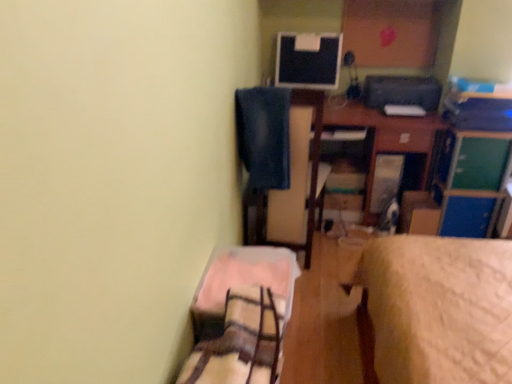
What do you see at coordinates (308, 60) in the screenshot?
I see `matte black monitor at upper center` at bounding box center [308, 60].

Locate an element on the screen. The height and width of the screenshot is (384, 512). wooden desk at center is located at coordinates point(386,139).

Describe the element at coordinates (471, 181) in the screenshot. The width and height of the screenshot is (512, 384). I see `green matte file cabinet at upper right` at that location.

At what (x,y) coordinates should I click in order to perform the action: click on matte black monitor at upper center. Please return your answer as a coordinate pair (x, y). The image size is (512, 384). Looking at the image, I should click on (308, 60).

Considering the sizes of objects plaid fabric bed at lower left and matte black monitor at upper center in the image provided, who is bigger, plaid fabric bed at lower left or matte black monitor at upper center?

matte black monitor at upper center is bigger.

Can you confirm if plaid fabric bed at lower left is shorter than matte black monitor at upper center?

Correct, plaid fabric bed at lower left is not as tall as matte black monitor at upper center.

Could you tell me if plaid fabric bed at lower left is facing matte black monitor at upper center?

No, plaid fabric bed at lower left is not facing towards matte black monitor at upper center.

Based on the photo, considering the relative positions of plaid fabric bed at lower left and matte black monitor at upper center in the image provided, is plaid fabric bed at lower left to the left or to the right of matte black monitor at upper center?

In the image, plaid fabric bed at lower left appears on the left side of matte black monitor at upper center.

Is cardboard box at center positioned behind green matte file cabinet at upper right?

Yes.

Find the location of a particular element. cardboard box on the left of green matte file cabinet at upper right is located at coordinates (419, 214).

From a real-world perspective, is cardboard box at center positioned above or below green matte file cabinet at upper right?

cardboard box at center is below green matte file cabinet at upper right.

Is cardboard box at center thinner than green matte file cabinet at upper right?

Indeed, cardboard box at center has a lesser width compared to green matte file cabinet at upper right.

Is plaid fabric bed at lower left to the right of cardboard box at center from the viewer's perspective?

Incorrect, plaid fabric bed at lower left is not on the right side of cardboard box at center.

In the scene shown: Is plaid fabric bed at lower left looking in the opposite direction of cardboard box at center?

No.

Considering the sizes of objects plaid fabric bed at lower left and cardboard box at center in the image provided, who is wider, plaid fabric bed at lower left or cardboard box at center?

Wider between the two is plaid fabric bed at lower left.

Can you tell me how much plaid fabric bed at lower left and cardboard box at center differ in facing direction?

87.5 degrees separate the facing orientations of plaid fabric bed at lower left and cardboard box at center.

Does matte black monitor at upper center have a lesser width compared to cardboard box at center?

Correct, the width of matte black monitor at upper center is less than that of cardboard box at center.

Where is `cardboard box that appears below the matte black monitor at upper center (from a real-world perspective)`? cardboard box that appears below the matte black monitor at upper center (from a real-world perspective) is located at coordinates (419, 214).

From the picture: Between matte black monitor at upper center and cardboard box at center, which one has more height?

Standing taller between the two is matte black monitor at upper center.

Who is smaller, wooden desk at center or cardboard box at center?

Smaller between the two is cardboard box at center.

From the image's perspective, is wooden desk at center located above cardboard box at center?

Yes, from the image's perspective, wooden desk at center is above cardboard box at center.

Is wooden desk at center next to cardboard box at center?

No, wooden desk at center is not beside cardboard box at center.

Is wooden desk at center looking in the opposite direction of cardboard box at center?

wooden desk at center does not have its back to cardboard box at center.

Who is smaller, matte black monitor at upper center or plaid fabric bed at lower left?

plaid fabric bed at lower left.

Is matte black monitor at upper center in front of or behind plaid fabric bed at lower left in the image?

matte black monitor at upper center is behind plaid fabric bed at lower left.

Consider the image. How distant is matte black monitor at upper center from plaid fabric bed at lower left?

The distance of matte black monitor at upper center from plaid fabric bed at lower left is 5.50 feet.

Between cardboard box at center and matte black monitor at upper center, which one has more height?

matte black monitor at upper center is taller.

Is cardboard box at center not within matte black monitor at upper center?

Yes, cardboard box at center is not within matte black monitor at upper center.

Consider the image. Which point is more distant from viewer, (404, 194) or (322, 50)?

Positioned behind is point (322, 50).

At what (x,y) coordinates should I click in order to perform the action: click on computer monitor that appears above the plaid fabric bed at lower left (from the image's perspective). Please return your answer as a coordinate pair (x, y). The height and width of the screenshot is (384, 512). Looking at the image, I should click on (308, 60).

Find the location of `cardboard box below the green matte file cabinet at upper right (from the image's perspective)`. cardboard box below the green matte file cabinet at upper right (from the image's perspective) is located at coordinates (419, 214).

Considering their positions, is green matte file cabinet at upper right positioned further to wooden desk at center than plaid fabric bed at lower left?

Among the two, plaid fabric bed at lower left is located further to wooden desk at center.

Which object lies further to the anchor point matte black monitor at upper center, plaid fabric bed at lower left or green matte file cabinet at upper right?

plaid fabric bed at lower left is further to matte black monitor at upper center.

In the scene shown: Based on their spatial positions, is green matte file cabinet at upper right or cardboard box at center closer to plaid fabric bed at lower left?

The object closer to plaid fabric bed at lower left is cardboard box at center.

When comparing their distances from blue fabric swivel chair at upper center, does plaid fabric bed at lower left or matte black monitor at upper center seem closer?

Based on the image, plaid fabric bed at lower left appears to be nearer to blue fabric swivel chair at upper center.

Considering their positions, is matte black monitor at upper center positioned closer to green matte file cabinet at upper right than wooden desk at center?

wooden desk at center.

From the picture: Looking at the image, which one is located further to plaid fabric bed at lower left, blue fabric swivel chair at upper center or green matte file cabinet at upper right?

green matte file cabinet at upper right lies further to plaid fabric bed at lower left than the other object.

Which object lies nearer to the anchor point green matte file cabinet at upper right, cardboard box at center or blue fabric swivel chair at upper center?

cardboard box at center lies closer to green matte file cabinet at upper right than the other object.

Considering their positions, is cardboard box at center positioned closer to plaid fabric bed at lower left than green matte file cabinet at upper right?

cardboard box at center is closer to plaid fabric bed at lower left.

The image size is (512, 384). Identify the location of cardboard box positioned between plaid fabric bed at lower left and matte black monitor at upper center from near to far. (419, 214).

Where is `table between matte black monitor at upper center and green matte file cabinet at upper right`? table between matte black monitor at upper center and green matte file cabinet at upper right is located at coordinates (386, 139).

Image resolution: width=512 pixels, height=384 pixels. What are the coordinates of `swivel chair located between plaid fabric bed at lower left and wooden desk at center in the depth direction` in the screenshot? It's located at (262, 150).

The height and width of the screenshot is (384, 512). Identify the location of swivel chair positioned between plaid fabric bed at lower left and cardboard box at center from near to far. (262, 150).